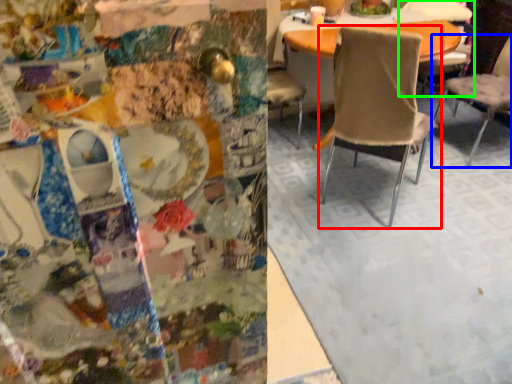
Question: Estimate the real-world distances between objects in this image. Which object is closer to chair (highlighted by a red box), chair (highlighted by a blue box) or chair (highlighted by a green box)?

Choices:
 (A) chair
 (B) chair

Answer: (A)